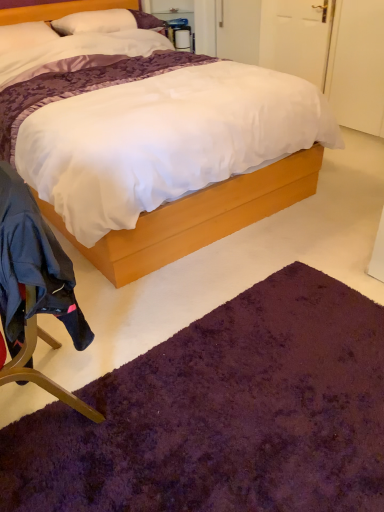
At what (x,y) coordinates should I click in order to perform the action: click on dark blue fabric chair at lower left. Please return your answer as a coordinate pair (x, y). The width and height of the screenshot is (384, 512). Looking at the image, I should click on point(34,288).

This screenshot has height=512, width=384. Describe the element at coordinates (106, 22) in the screenshot. I see `white soft pillow at upper left` at that location.

The width and height of the screenshot is (384, 512). In order to click on dark blue fabric chair at lower left in this screenshot , I will do `click(34, 288)`.

Is purple shaggy rug at lower center oriented away from white soft pillow at upper left?

That's not correct — purple shaggy rug at lower center is not looking away from white soft pillow at upper left.

From a real-world perspective, is purple shaggy rug at lower center positioned under white soft pillow at upper left based on gravity?

Yes, from a real-world perspective, purple shaggy rug at lower center is below white soft pillow at upper left.

Considering the sizes of objects purple shaggy rug at lower center and white soft pillow at upper left in the image provided, who is smaller, purple shaggy rug at lower center or white soft pillow at upper left?

With smaller size is white soft pillow at upper left.

Which is more to the left, purple shaggy rug at lower center or white soft pillow at upper left?

white soft pillow at upper left.

Between purple shaggy rug at lower center and purple plush rug at lower center, which one has more height?

purple plush rug at lower center is taller.

Is purple shaggy rug at lower center wider or thinner than purple plush rug at lower center?

purple shaggy rug at lower center is thinner than purple plush rug at lower center.

Between purple shaggy rug at lower center and purple plush rug at lower center, which one appears on the right side from the viewer's perspective?

purple shaggy rug at lower center.

How many degrees apart are the facing directions of purple shaggy rug at lower center and purple plush rug at lower center?

purple shaggy rug at lower center and purple plush rug at lower center are facing 180 degrees away from each other.

Does point (285, 64) come closer to viewer compared to point (130, 254)?

No, it is not.

Consider the image. Considering the sizes of white matte door at upper right and purple plush rug at lower center in the image, is white matte door at upper right taller or shorter than purple plush rug at lower center?

Clearly, white matte door at upper right is shorter compared to purple plush rug at lower center.

The width and height of the screenshot is (384, 512). Identify the location of bed below the white matte door at upper right (from the image's perspective). (198, 218).

Is dark blue fabric chair at lower left wider than purple plush rug at lower center?

Incorrect, the width of dark blue fabric chair at lower left does not surpass that of purple plush rug at lower center.

Could you tell me if dark blue fabric chair at lower left is facing purple plush rug at lower center?

No, dark blue fabric chair at lower left does not turn towards purple plush rug at lower center.

From a real-world perspective, is dark blue fabric chair at lower left positioned above or below purple plush rug at lower center?

In terms of real-world spatial position, dark blue fabric chair at lower left is below purple plush rug at lower center.

Locate an element on the screen. The height and width of the screenshot is (512, 384). door above the dark blue fabric chair at lower left (from a real-world perspective) is located at coordinates click(297, 37).

Is white matte door at upper right turned away from dark blue fabric chair at lower left?

That's not correct — white matte door at upper right is not looking away from dark blue fabric chair at lower left.

From the image's perspective, which one is positioned lower, white matte door at upper right or dark blue fabric chair at lower left?

dark blue fabric chair at lower left appears lower in the image.

From the image's perspective, between purple shaggy rug at lower center and white matte door at upper right, who is located below?

purple shaggy rug at lower center, from the image's perspective.

What are the coordinates of `mat beneath the white matte door at upper right (from a real-world perspective)` in the screenshot? It's located at (223, 414).

Does point (61, 465) lie in front of point (308, 9)?

Yes, point (61, 465) is in front of point (308, 9).

Considering the sizes of objects purple shaggy rug at lower center and white matte door at upper right in the image provided, who is taller, purple shaggy rug at lower center or white matte door at upper right?

white matte door at upper right.

Does point (217, 192) come behind point (135, 13)?

No, (217, 192) is closer to viewer.

From the picture: From their relative heights in the image, would you say purple plush rug at lower center is taller or shorter than white soft pillow at upper left?

Considering their sizes, purple plush rug at lower center has more height than white soft pillow at upper left.

Would you say purple plush rug at lower center contains white soft pillow at upper left?

Yes, white soft pillow at upper left is a part of purple plush rug at lower center.

Where is `pillow behind the purple plush rug at lower center`? Image resolution: width=384 pixels, height=512 pixels. pillow behind the purple plush rug at lower center is located at coordinates (106, 22).

This screenshot has height=512, width=384. In order to click on mat in front of the white soft pillow at upper left in this screenshot , I will do `click(223, 414)`.

Where is `bed that appears above the purple shaggy rug at lower center (from a real-world perspective)`? This screenshot has width=384, height=512. bed that appears above the purple shaggy rug at lower center (from a real-world perspective) is located at coordinates click(198, 218).

From the image, which object appears to be farther from purple plush rug at lower center, dark blue fabric chair at lower left or white matte door at upper right?

Based on the image, white matte door at upper right appears to be further to purple plush rug at lower center.

Estimate the real-world distances between objects in this image. Which object is further from purple plush rug at lower center, dark blue fabric chair at lower left or purple shaggy rug at lower center?

purple shaggy rug at lower center lies further to purple plush rug at lower center than the other object.

Which object lies nearer to the anchor point purple plush rug at lower center, dark blue fabric chair at lower left or white soft pillow at upper left?

Based on the image, dark blue fabric chair at lower left appears to be nearer to purple plush rug at lower center.

From the image, which object appears to be nearer to white soft pillow at upper left, white matte door at upper right or dark blue fabric chair at lower left?

white matte door at upper right.

Based on the photo, looking at the image, which one is located further to dark blue fabric chair at lower left, white soft pillow at upper left or purple shaggy rug at lower center?

The object further to dark blue fabric chair at lower left is white soft pillow at upper left.

When comparing their distances from white matte door at upper right, does white soft pillow at upper left or dark blue fabric chair at lower left seem further?

dark blue fabric chair at lower left is further to white matte door at upper right.

Estimate the real-world distances between objects in this image. Which object is closer to white matte door at upper right, purple plush rug at lower center or purple shaggy rug at lower center?

purple plush rug at lower center lies closer to white matte door at upper right than the other object.

Based on their spatial positions, is purple plush rug at lower center or white matte door at upper right closer to purple shaggy rug at lower center?

purple plush rug at lower center is positioned closer to the anchor purple shaggy rug at lower center.

Find the location of a particular element. The height and width of the screenshot is (512, 384). chair between purple shaggy rug at lower center and white matte door at upper right along the z-axis is located at coordinates (x=34, y=288).

The image size is (384, 512). In order to click on pillow between white matte door at upper right and purple shaggy rug at lower center vertically in this screenshot , I will do `click(106, 22)`.

Locate an element on the screen. chair between purple plush rug at lower center and purple shaggy rug at lower center from top to bottom is located at coordinates (34, 288).

Identify the location of bed located between dark blue fabric chair at lower left and white matte door at upper right in the depth direction. Image resolution: width=384 pixels, height=512 pixels. (198, 218).